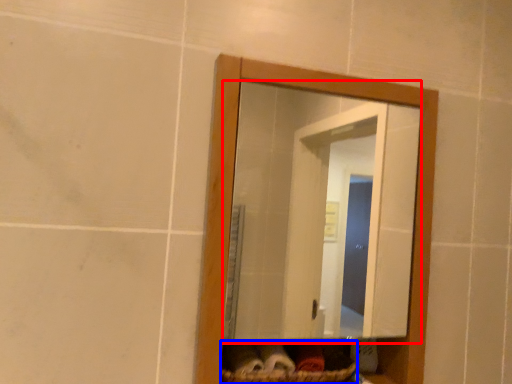
Question: Among these objects, which one is farthest to the camera, mirror (highlighted by a red box) or basket (highlighted by a blue box)?

Choices:
 (A) mirror
 (B) basket

Answer: (B)